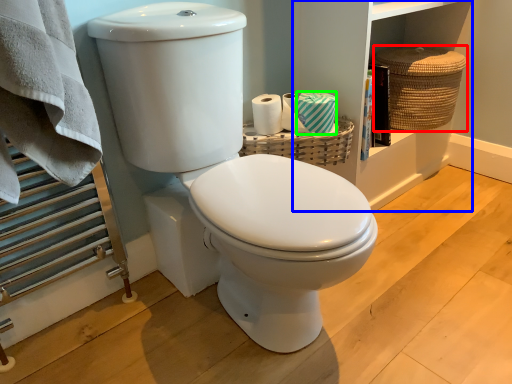
Question: Estimate the real-world distances between objects in this image. Which object is farther from basket (highlighted by a red box), bookshelf (highlighted by a blue box) or toilet paper (highlighted by a green box)?

Choices:
 (A) bookshelf
 (B) toilet paper

Answer: (B)